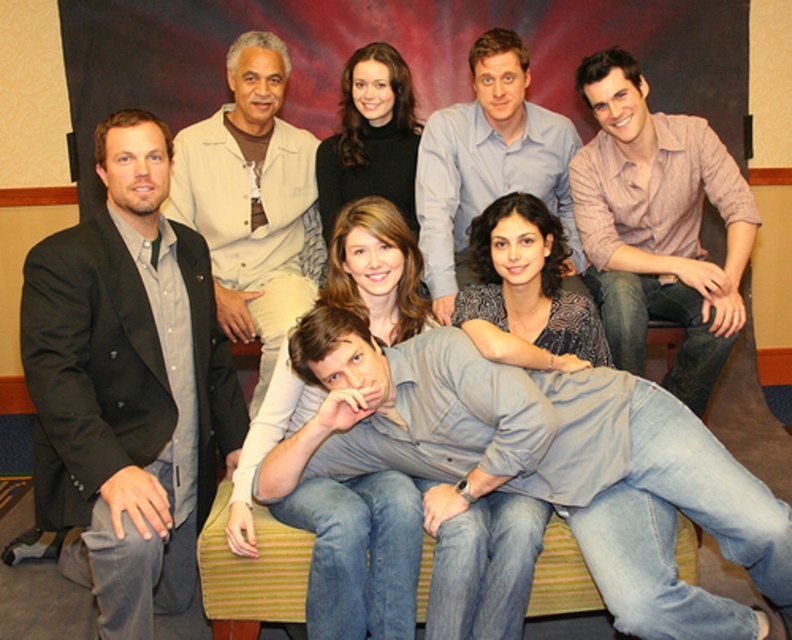
You are a photographer trying to adjust the lighting for the group photo. You need to ensure that the dark gray suit at left and the beige textured shirt at upper center are both well lit. Based on their positions, which one might require more direct lighting to avoid appearing too shadowy?

The dark gray suit at left is in front of the beige textured shirt at upper center, so it might block some light from reaching the beige textured shirt at upper center. Therefore, the beige textured shirt at upper center may need more direct lighting to avoid appearing shadowy.

You are organizing a photo shoot and need to ensure that the dark gray suit at left and the beige textured shirt at upper center are visible in the frame. Based on their sizes, which one might require more space to fully capture in the photo?

The beige textured shirt at upper center requires more space because it has a greater width than the dark gray suit at left.

You are a photographer trying to adjust the lighting for a group photo. You notice the denim jeans at lower right and the light blue shirt at center. Which object requires more vertical space in the frame to avoid being cut off?

The denim jeans at lower right requires more vertical space in the frame because it has a greater height compared to the light blue shirt at center.